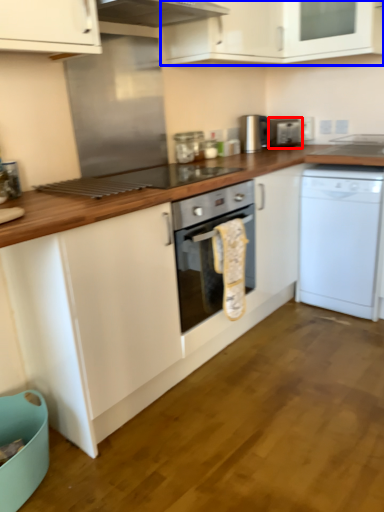
Question: Which object is further to the camera taking this photo, appliance (highlighted by a red box) or cabinetry (highlighted by a blue box)?

Choices:
 (A) appliance
 (B) cabinetry

Answer: (A)